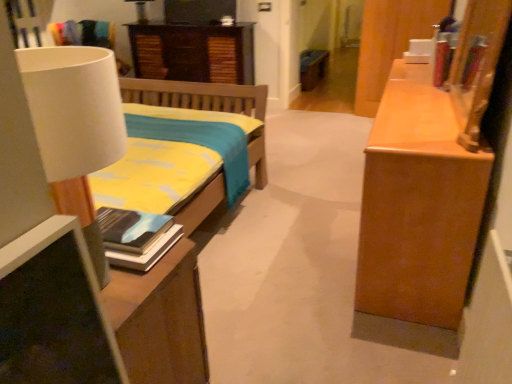
Describe the element at coordinates (75, 127) in the screenshot. I see `white matte lamp at left, arranged as the 1th lamp when ordered from the bottom` at that location.

The width and height of the screenshot is (512, 384). I want to click on dark wood cabinet at upper center, so click(193, 52).

This screenshot has height=384, width=512. In order to click on matte white lampshade at upper left, placed as the 1th lamp when sorted from top to bottom in this screenshot , I will do `click(140, 10)`.

Describe the element at coordinates (312, 68) in the screenshot. I see `wooden cabinet at center, arranged as the second cabinetry when viewed from the front` at that location.

Locate an element on the screen. hardcover book at left is located at coordinates (136, 237).

Find the location of `white matte lamp at left, arranged as the 1th lamp when ordered from the bottom`. white matte lamp at left, arranged as the 1th lamp when ordered from the bottom is located at coordinates (75, 127).

From the image's perspective, relative to wooden cabinet at right, the 1th cabinetry when ordered from front to back, is white matte lamp at left, which is the second lamp from top to bottom, above or below?

Clearly, from the image's perspective, white matte lamp at left, which is the second lamp from top to bottom, is below wooden cabinet at right, the 1th cabinetry when ordered from front to back.

From a real-world perspective, which is physically above, white matte lamp at left, which is counted as the 2th lamp, starting from the back, or wooden cabinet at right, which ranks as the 2th cabinetry in left-to-right order?

In real-world perspective, white matte lamp at left, which is counted as the 2th lamp, starting from the back, is above.

How much distance is there between white matte lamp at left, which is the 1th lamp in front-to-back order, and wooden cabinet at right, the first cabinetry when ordered from right to left?

white matte lamp at left, which is the 1th lamp in front-to-back order, is 13.20 feet from wooden cabinet at right, the first cabinetry when ordered from right to left.

Is point (40, 121) positioned behind point (376, 12)?

No, it is in front of (376, 12).

Considering the relative positions of white matte lamp at left, which is the 1th lamp in front-to-back order, and matte white lampshade at upper left, the second lamp when ordered from front to back, in the image provided, is white matte lamp at left, which is the 1th lamp in front-to-back order, to the left or to the right of matte white lampshade at upper left, the second lamp when ordered from front to back,?

Clearly, white matte lamp at left, which is the 1th lamp in front-to-back order, is on the right of matte white lampshade at upper left, the second lamp when ordered from front to back, in the image.

Between point (91, 201) and point (143, 5), which one is positioned in front?

Positioned in front is point (91, 201).

Which is in front, white matte lamp at left, which is the 1th lamp in front-to-back order, or matte white lampshade at upper left, which ranks as the 1th lamp in back-to-front order?

Positioned in front is white matte lamp at left, which is the 1th lamp in front-to-back order.

Is wooden cabinet at right, which ranks as the 2th cabinetry in left-to-right order, taller than wooden cabinet at center, which ranks as the 1th cabinetry in back-to-front order?

Indeed, wooden cabinet at right, which ranks as the 2th cabinetry in left-to-right order, has a greater height compared to wooden cabinet at center, which ranks as the 1th cabinetry in back-to-front order.

Looking at their sizes, would you say wooden cabinet at right, which ranks as the 2th cabinetry in left-to-right order, is wider or thinner than wooden cabinet at center, which is counted as the first cabinetry, starting from the left?

Considering their sizes, wooden cabinet at right, which ranks as the 2th cabinetry in left-to-right order, looks slimmer than wooden cabinet at center, which is counted as the first cabinetry, starting from the left.

From the picture: Can you tell me how much wooden cabinet at right, the 2th cabinetry from the back, and wooden cabinet at center, which ranks as the 1th cabinetry in back-to-front order, differ in facing direction?

The facing directions of wooden cabinet at right, the 2th cabinetry from the back, and wooden cabinet at center, which ranks as the 1th cabinetry in back-to-front order, are 103 degrees apart.

Is wooden cabinet at right, the 1th cabinetry when ordered from front to back, turned away from wooden cabinet at center, arranged as the second cabinetry when viewed from the front?

wooden cabinet at right, the 1th cabinetry when ordered from front to back, does not have its back to wooden cabinet at center, arranged as the second cabinetry when viewed from the front.

Is white matte lamp at left, which appears as the 1th lamp when viewed from the right, positioned with its back to hardcover book at left?

white matte lamp at left, which appears as the 1th lamp when viewed from the right, is not turned away from hardcover book at left.

Can you confirm if white matte lamp at left, which is the second lamp from top to bottom, is positioned to the left of hardcover book at left?

Indeed, white matte lamp at left, which is the second lamp from top to bottom, is positioned on the left side of hardcover book at left.

Is the surface of white matte lamp at left, arranged as the 1th lamp when ordered from the bottom, in direct contact with hardcover book at left?

No, white matte lamp at left, arranged as the 1th lamp when ordered from the bottom, is not beside hardcover book at left.

From their relative heights in the image, would you say white matte lamp at left, which is counted as the 2th lamp, starting from the back, is taller or shorter than hardcover book at left?

Clearly, white matte lamp at left, which is counted as the 2th lamp, starting from the back, is taller compared to hardcover book at left.

Can you confirm if hardcover book at left is taller than wooden cabinet at center, which is counted as the first cabinetry, starting from the left?

Incorrect, the height of hardcover book at left is not larger of that of wooden cabinet at center, which is counted as the first cabinetry, starting from the left.

Which object is further away from the camera, hardcover book at left or wooden cabinet at center, which is counted as the first cabinetry, starting from the left?

wooden cabinet at center, which is counted as the first cabinetry, starting from the left, is further away from the camera.

Which of these two, hardcover book at left or wooden cabinet at center, the second cabinetry viewed from the right, is thinner?

hardcover book at left is thinner.

Are hardcover book at left and wooden cabinet at center, the second cabinetry viewed from the right, located far from each other?

hardcover book at left is far away from wooden cabinet at center, the second cabinetry viewed from the right.

From the picture: Who is more distant, white matte lamp at left, which is the 1th lamp in front-to-back order, or dark wood cabinet at upper center?

dark wood cabinet at upper center.

Locate an element on the screen. nightstand located above the white matte lamp at left, arranged as the 1th lamp when ordered from the bottom (from the image's perspective) is located at coordinates (193, 52).

Is white matte lamp at left, which appears as the 1th lamp when viewed from the right, outside of dark wood cabinet at upper center?

white matte lamp at left, which appears as the 1th lamp when viewed from the right, lies outside dark wood cabinet at upper center's area.

From the image's perspective, does dark wood cabinet at upper center appear higher than hardcover book at left?

Correct, dark wood cabinet at upper center appears higher than hardcover book at left in the image.

How different are the orientations of dark wood cabinet at upper center and hardcover book at left in degrees?

The angle between the facing direction of dark wood cabinet at upper center and the facing direction of hardcover book at left is 178 degrees.

Is dark wood cabinet at upper center in contact with hardcover book at left?

dark wood cabinet at upper center is not next to hardcover book at left, and they're not touching.

Considering the relative sizes of dark wood cabinet at upper center and hardcover book at left in the image provided, is dark wood cabinet at upper center taller than hardcover book at left?

Correct, dark wood cabinet at upper center is much taller as hardcover book at left.

The height and width of the screenshot is (384, 512). There is a white matte lamp at left, which is the second lamp in left-to-right order. What are the coordinates of `the 1st cabinetry below it (from a real-world perspective)` in the screenshot? It's located at (390, 42).

Where is `lamp below the matte white lampshade at upper left, which ranks as the 1th lamp in back-to-front order (from the image's perspective)`? The width and height of the screenshot is (512, 384). lamp below the matte white lampshade at upper left, which ranks as the 1th lamp in back-to-front order (from the image's perspective) is located at coordinates (75, 127).

When comparing their distances from dark wood cabinet at upper center, does wooden cabinet at right, the 1th cabinetry when ordered from front to back, or white matte lamp at left, which appears as the 1th lamp when viewed from the right, seem closer?

The object closer to dark wood cabinet at upper center is wooden cabinet at right, the 1th cabinetry when ordered from front to back.

Based on their spatial positions, is dark wood cabinet at upper center or hardcover book at left further from white matte lamp at left, which is the second lamp in left-to-right order?

dark wood cabinet at upper center lies further to white matte lamp at left, which is the second lamp in left-to-right order, than the other object.

Looking at this image, considering their positions, is dark wood cabinet at upper center positioned closer to hardcover book at left than white matte lamp at left, which is the 1th lamp in front-to-back order?

white matte lamp at left, which is the 1th lamp in front-to-back order, lies closer to hardcover book at left than the other object.

When comparing their distances from matte white lampshade at upper left, which appears as the 2th lamp when viewed from the right, does white matte lamp at left, which appears as the 1th lamp when viewed from the right, or dark wood cabinet at upper center seem further?

white matte lamp at left, which appears as the 1th lamp when viewed from the right, is positioned further to the anchor matte white lampshade at upper left, which appears as the 2th lamp when viewed from the right.

Considering their positions, is dark wood cabinet at upper center positioned further to wooden cabinet at center, arranged as the second cabinetry when viewed from the front, than hardcover book at left?

hardcover book at left is positioned further to the anchor wooden cabinet at center, arranged as the second cabinetry when viewed from the front.

From the image, which object appears to be nearer to wooden cabinet at center, which is counted as the first cabinetry, starting from the left, hardcover book at left or dark wood cabinet at upper center?

Among the two, dark wood cabinet at upper center is located nearer to wooden cabinet at center, which is counted as the first cabinetry, starting from the left.

Estimate the real-world distances between objects in this image. Which object is closer to matte white lampshade at upper left, the first lamp positioned from the left, wooden cabinet at right, the first cabinetry when ordered from right to left, or hardcover book at left?

wooden cabinet at right, the first cabinetry when ordered from right to left, is positioned closer to the anchor matte white lampshade at upper left, the first lamp positioned from the left.

Estimate the real-world distances between objects in this image. Which object is closer to matte white lampshade at upper left, which is the 2th lamp from bottom to top, white matte lamp at left, which is the 1th lamp in front-to-back order, or wooden cabinet at right, the first cabinetry when ordered from right to left?

wooden cabinet at right, the first cabinetry when ordered from right to left.

Identify the location of cabinetry between hardcover book at left and dark wood cabinet at upper center from front to back. The height and width of the screenshot is (384, 512). (390, 42).

I want to click on nightstand between matte white lampshade at upper left, the first lamp positioned from the left, and wooden cabinet at center, the second cabinetry viewed from the right, so click(193, 52).

Locate an element on the screen. Image resolution: width=512 pixels, height=384 pixels. nightstand located between white matte lamp at left, which is the second lamp from top to bottom, and matte white lampshade at upper left, which ranks as the 1th lamp in back-to-front order, in the depth direction is located at coordinates (193, 52).

Image resolution: width=512 pixels, height=384 pixels. I want to click on book positioned between white matte lamp at left, which is the 1th lamp in front-to-back order, and matte white lampshade at upper left, the first lamp positioned from the left, from near to far, so click(x=136, y=237).